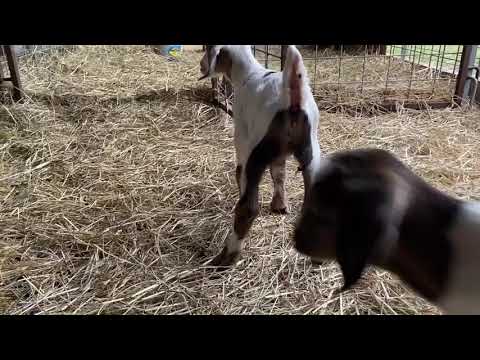
Where is `crate`? crate is located at coordinates (390, 66).